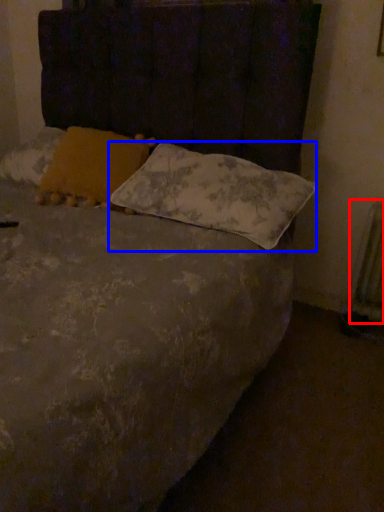
Question: Which object appears farthest to the camera in this image, radiator (highlighted by a red box) or pillow (highlighted by a blue box)?

Choices:
 (A) radiator
 (B) pillow

Answer: (A)